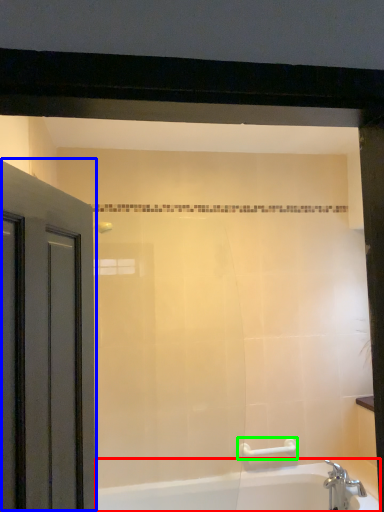
Question: Which object is positioned closest to bathtub (highlighted by a red box)? Select from door (highlighted by a blue box) and towel bar (highlighted by a green box).

Choices:
 (A) door
 (B) towel bar

Answer: (B)